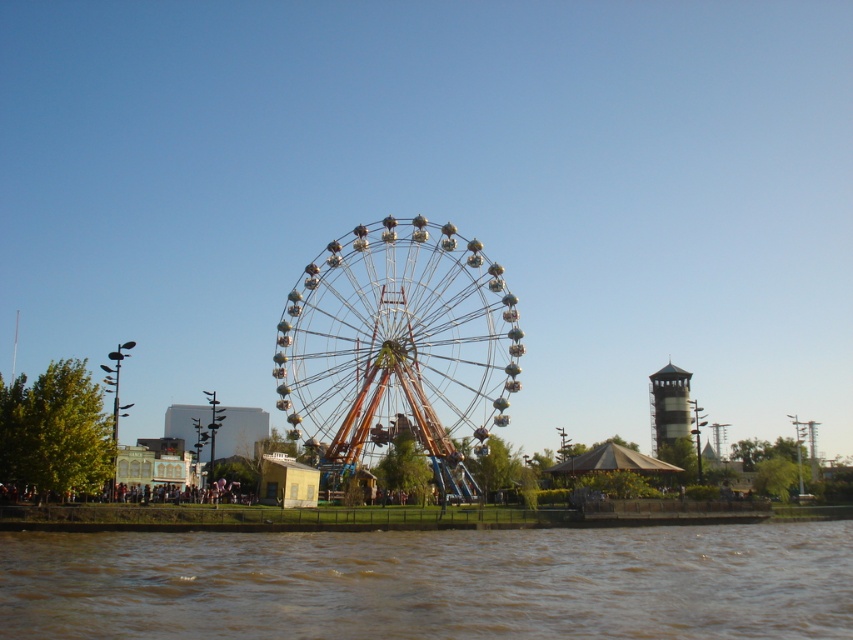
You are standing at the entrance of the amusement park and want to locate the metallic silver ferris wheel at center. According to the map, your current position is at point 0.5. Where should you move to find it?

The metallic silver ferris wheel at center is located at point 0.547, so you should move to the right from your current position at point 0.5 to reach it.

Consider the image. You are standing at the base of the Ferris wheel and want to reach the brown muddy water at lower center. Is the distance more than 300 feet?

The distance of brown muddy water at lower center from viewer is 395.07 feet, which is more than 300 feet, so yes.

You are standing at the camera position and want to take a photo of the metallic silver ferris wheel at center. If your camera has a maximum zoom range of 100 meters, will you be able to capture the entire ferris wheel in the photo without moving closer?

The metallic silver ferris wheel at center is 148.64 meters away from the camera. Since the camera can only zoom up to 100 meters, it cannot capture the entire ferris wheel without moving closer.